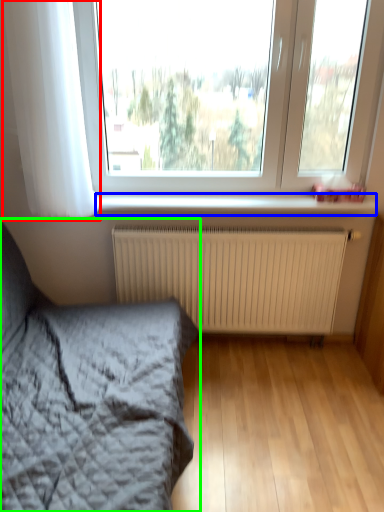
Question: Which object is positioned farthest from curtain (highlighted by a red box)? Select from window sill (highlighted by a blue box) and bed (highlighted by a green box).

Choices:
 (A) window sill
 (B) bed

Answer: (B)